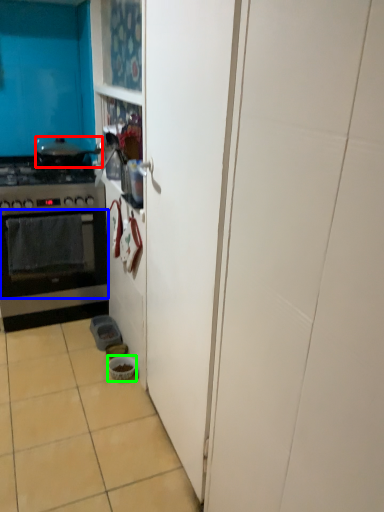
Question: Which is nearer to the pot/pan (highlighted by a red box)? oven (highlighted by a blue box) or bowl (highlighted by a green box).

Choices:
 (A) oven
 (B) bowl

Answer: (A)